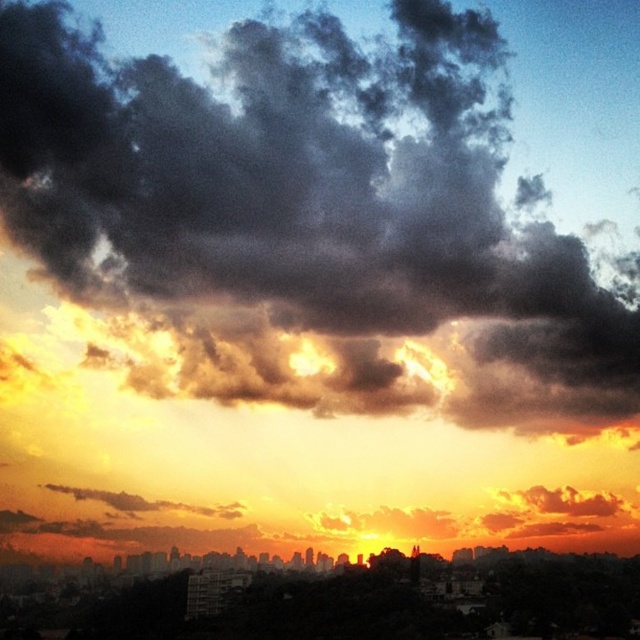
Question: Where is dark gray fluffy cloud at upper center located in relation to silhouetted cityscape at center in the image?

Choices:
 (A) right
 (B) left

Answer: (B)

Question: From the image, what is the correct spatial relationship of dark gray fluffy cloud at upper center in relation to silhouetted cityscape at center?

Choices:
 (A) above
 (B) below

Answer: (A)

Question: Which point is farther from the camera taking this photo?

Choices:
 (A) (365, 224)
 (B) (72, 628)

Answer: (B)

Question: Which object appears closest to the camera in this image?

Choices:
 (A) dark gray fluffy cloud at upper center
 (B) silhouetted cityscape at center

Answer: (A)

Question: Can you confirm if dark gray fluffy cloud at upper center is thinner than silhouetted cityscape at center?

Choices:
 (A) yes
 (B) no

Answer: (B)